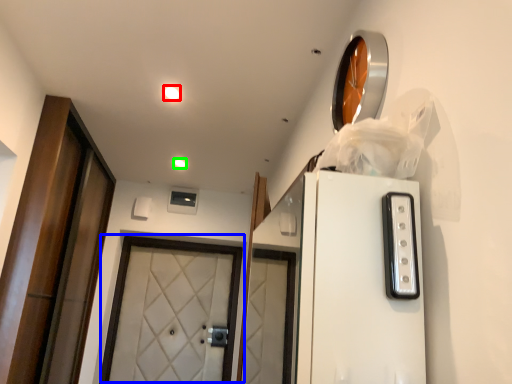
Question: Considering the real-world distances, which object is farthest from lighting (highlighted by a red box)? door (highlighted by a blue box) or lighting (highlighted by a green box)?

Choices:
 (A) door
 (B) lighting

Answer: (A)